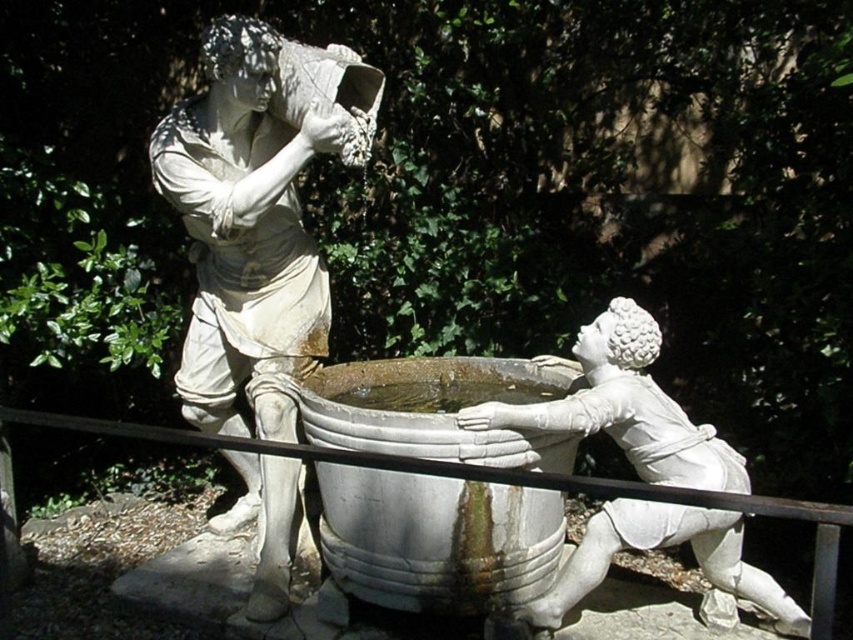
Question: Is white stone statue at left wider than metal rail at lower center?

Choices:
 (A) yes
 (B) no

Answer: (A)

Question: Among these objects, which one is farthest from the camera?

Choices:
 (A) metal rail at lower center
 (B) white marble boy at lower right
 (C) white stone statue at left

Answer: (A)

Question: Which is farther from the white marble boy at lower right?

Choices:
 (A) white stone basin at center
 (B) white stone statue at left

Answer: (B)

Question: Which point appears closest to the camera in this image?

Choices:
 (A) (372, 413)
 (B) (634, 481)
 (C) (196, 280)
 (D) (577, 356)

Answer: (A)

Question: Can you confirm if white stone statue at left is positioned above white marble boy at lower right?

Choices:
 (A) yes
 (B) no

Answer: (A)

Question: Can you confirm if white stone statue at left is bigger than white stone basin at center?

Choices:
 (A) no
 (B) yes

Answer: (B)